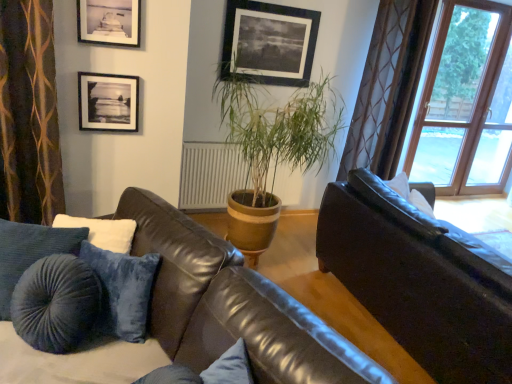
Question: Which is correct: brown textured curtain at left is inside leather couch at center, positioned as the 2th studio couch in right-to-left order, or outside of it?

Choices:
 (A) inside
 (B) outside

Answer: (B)

Question: Considering the positions of brown textured curtain at left and leather couch at center, positioned as the 2th studio couch in right-to-left order, in the image, is brown textured curtain at left bigger or smaller than leather couch at center, positioned as the 2th studio couch in right-to-left order,?

Choices:
 (A) big
 (B) small

Answer: (B)

Question: Which is farther from the green leafy plant at center?

Choices:
 (A) black matte picture frame at upper center, positioned as the first picture frame in top-to-bottom order
 (B) brown textured curtain at left
 (C) black matte picture frame at upper left, positioned as the 2th picture frame in front-to-back order
 (D) clear glass window at upper right
 (E) white soft pillow at upper right

Answer: (D)

Question: Which object is positioned farthest from the matte black picture frame at upper left, which appears as the second picture frame when viewed from the top?

Choices:
 (A) black matte picture frame at upper left, positioned as the 2th picture frame in front-to-back order
 (B) leather couch at center, the first studio couch positioned from the left
 (C) clear glass window at upper right
 (D) green leafy plant at center
 (E) black matte picture frame at upper center, which ranks as the 1th picture frame in right-to-left order

Answer: (C)